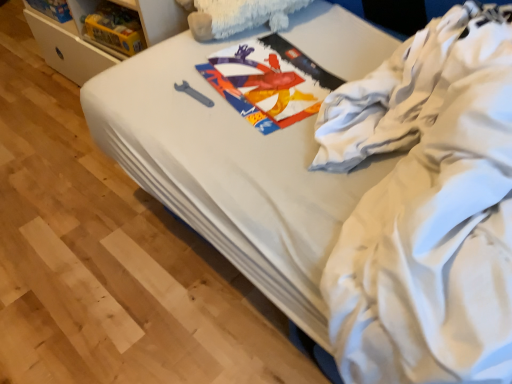
Question: Considering the relative sizes of gray matte wrench at center and white cotton shirt at upper right in the image provided, is gray matte wrench at center taller than white cotton shirt at upper right?

Choices:
 (A) no
 (B) yes

Answer: (A)

Question: Can you confirm if gray matte wrench at center is smaller than white cotton shirt at upper right?

Choices:
 (A) no
 (B) yes

Answer: (B)

Question: From a real-world perspective, is gray matte wrench at center on top of white cotton shirt at upper right?

Choices:
 (A) yes
 (B) no

Answer: (B)

Question: Does gray matte wrench at center come in front of white cotton shirt at upper right?

Choices:
 (A) no
 (B) yes

Answer: (A)

Question: Is white cotton shirt at upper right a part of gray matte wrench at center?

Choices:
 (A) yes
 (B) no

Answer: (B)

Question: Is gray matte wrench at center thinner than white cotton shirt at upper right?

Choices:
 (A) yes
 (B) no

Answer: (A)

Question: Is white cotton shirt at upper right next to gray matte wrench at center?

Choices:
 (A) yes
 (B) no

Answer: (B)

Question: Does white cotton shirt at upper right have a lesser width compared to gray matte wrench at center?

Choices:
 (A) no
 (B) yes

Answer: (A)

Question: Is white cotton shirt at upper right taller than gray matte wrench at center?

Choices:
 (A) yes
 (B) no

Answer: (A)

Question: Is white cotton shirt at upper right at the left side of gray matte wrench at center?

Choices:
 (A) yes
 (B) no

Answer: (B)

Question: Are white cotton shirt at upper right and gray matte wrench at center located far from each other?

Choices:
 (A) no
 (B) yes

Answer: (A)

Question: Is white cotton shirt at upper right not within gray matte wrench at center?

Choices:
 (A) yes
 (B) no

Answer: (A)

Question: Is point (201, 94) positioned closer to the camera than point (431, 344)?

Choices:
 (A) closer
 (B) farther

Answer: (B)